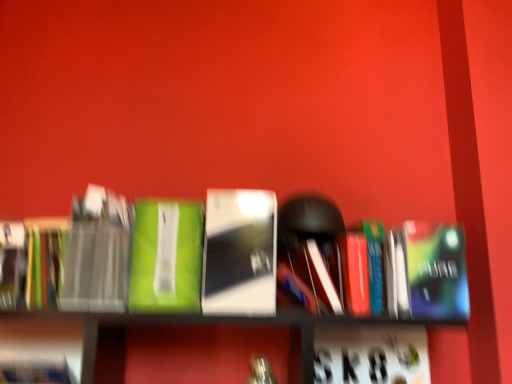
Question: Which direction should I rotate to face green matte book at center, the second book positioned from the right, — up or down?

Choices:
 (A) up
 (B) down

Answer: (B)

Question: Considering the relative sizes of multicolored paper at left, which appears as the 3th paperback book when viewed from the right, and hardcover book at left, the 1th paperback book viewed from the left, in the image provided, is multicolored paper at left, which appears as the 3th paperback book when viewed from the right, bigger than hardcover book at left, the 1th paperback book viewed from the left,?

Choices:
 (A) no
 (B) yes

Answer: (B)

Question: Can you confirm if multicolored paper at left, which appears as the 3th paperback book when viewed from the right, is smaller than hardcover book at left, the 4th paperback book from the right?

Choices:
 (A) no
 (B) yes

Answer: (A)

Question: Would you consider multicolored paper at left, the 2th paperback book in the left-to-right sequence, to be distant from hardcover book at left, the 4th paperback book from the right?

Choices:
 (A) no
 (B) yes

Answer: (A)

Question: Considering the relative positions of multicolored paper at left, the 2th paperback book in the left-to-right sequence, and hardcover book at left, the 4th paperback book from the right, in the image provided, is multicolored paper at left, the 2th paperback book in the left-to-right sequence, to the left of hardcover book at left, the 4th paperback book from the right, from the viewer's perspective?

Choices:
 (A) no
 (B) yes

Answer: (A)

Question: From the image's perspective, is multicolored paper at left, the 2th paperback book in the left-to-right sequence, located above hardcover book at left, the 4th paperback book from the right?

Choices:
 (A) no
 (B) yes

Answer: (B)

Question: Is multicolored paper at left, which appears as the 3th paperback book when viewed from the right, at the right side of hardcover book at left, the 1th paperback book viewed from the left?

Choices:
 (A) no
 (B) yes

Answer: (B)

Question: Is matte black book at left, the second paperback book positioned from the right, far away from hardcover book at left, the 1th paperback book viewed from the left?

Choices:
 (A) no
 (B) yes

Answer: (A)

Question: Is matte black book at left, the second paperback book positioned from the right, aimed at hardcover book at left, the 4th paperback book from the right?

Choices:
 (A) no
 (B) yes

Answer: (A)

Question: From a real-world perspective, does matte black book at left, the second paperback book positioned from the right, stand above hardcover book at left, the 1th paperback book viewed from the left?

Choices:
 (A) no
 (B) yes

Answer: (B)

Question: Is matte black book at left, which ranks as the 3th paperback book in left-to-right order, positioned with its back to hardcover book at left, the 1th paperback book viewed from the left?

Choices:
 (A) yes
 (B) no

Answer: (B)

Question: Does matte black book at left, the second paperback book positioned from the right, have a greater height compared to hardcover book at left, the 1th paperback book viewed from the left?

Choices:
 (A) yes
 (B) no

Answer: (A)

Question: From a real-world perspective, is matte black book at left, which ranks as the 3th paperback book in left-to-right order, located beneath hardcover book at left, the 1th paperback book viewed from the left?

Choices:
 (A) yes
 (B) no

Answer: (B)

Question: Does multicolored paper at left, the 2th paperback book in the left-to-right sequence, appear on the left side of matte black book at left, the second paperback book positioned from the right?

Choices:
 (A) no
 (B) yes

Answer: (B)